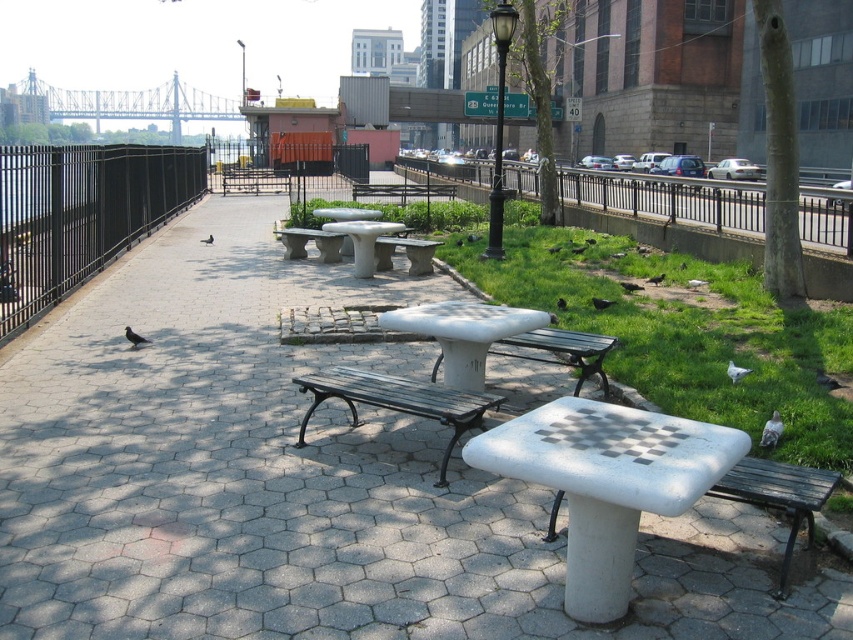
Is point (612, 593) positioned in front of point (392, 321)?

Yes, point (612, 593) is in front of point (392, 321).

Does point (612, 445) lie in front of point (547, 320)?

Yes, point (612, 445) is in front of point (547, 320).

At what (x,y) coordinates should I click in order to perform the action: click on white concrete picnic table at center. Please return your answer as a coordinate pair (x, y). Looking at the image, I should click on (607, 483).

Does white concrete picnic table at center have a greater width compared to black metal fence at left?

No.

This screenshot has height=640, width=853. Find the location of `white concrete picnic table at center`. white concrete picnic table at center is located at coordinates (607, 483).

Does point (622, 410) come in front of point (10, 253)?

Yes, point (622, 410) is in front of point (10, 253).

In order to click on white concrete picnic table at center in this screenshot , I will do `click(607, 483)`.

Between green grass at center and wooden park bench at lower right, which one has less height?

With less height is wooden park bench at lower right.

Locate an element on the screen. green grass at center is located at coordinates (679, 330).

At what (x,y) coordinates should I click in order to perform the action: click on green grass at center. Please return your answer as a coordinate pair (x, y). The height and width of the screenshot is (640, 853). Looking at the image, I should click on (679, 330).